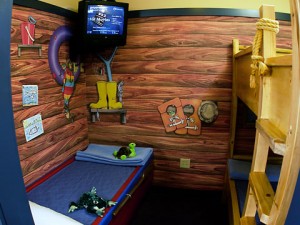
I want to click on 2 beds on bunk bed, so [x=245, y=182], [x=283, y=56].